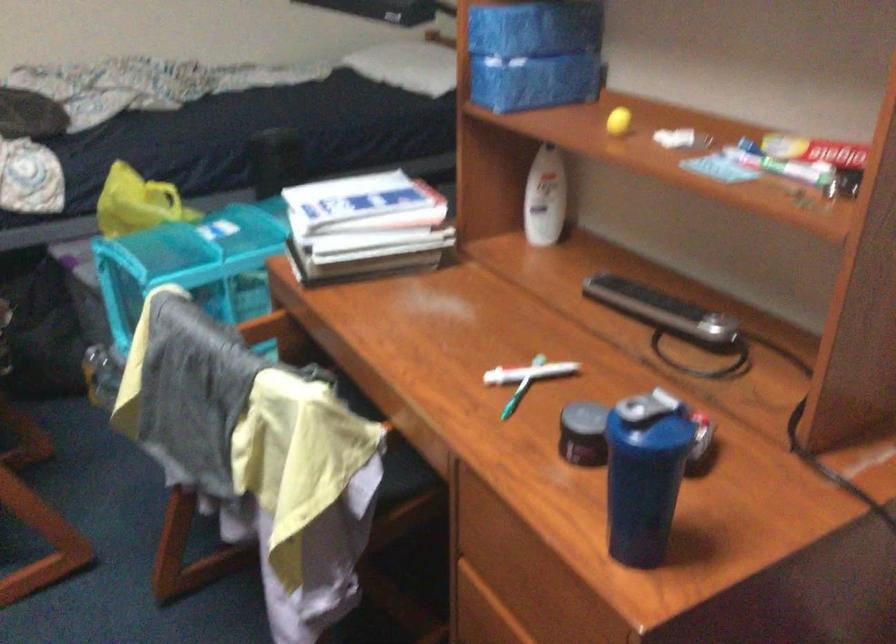
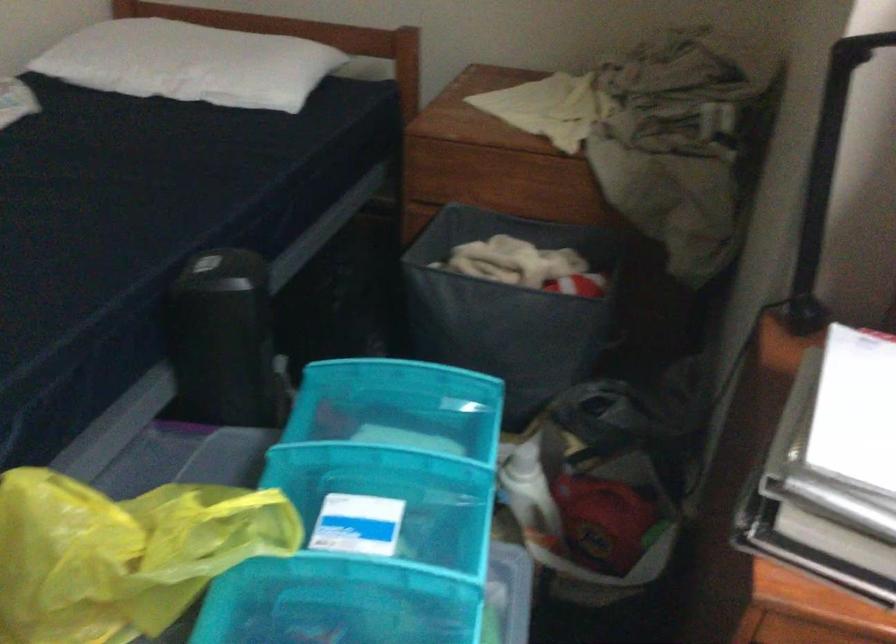
In the second image, find the point that corresponds to point 259,216 in the first image.

(376, 451)